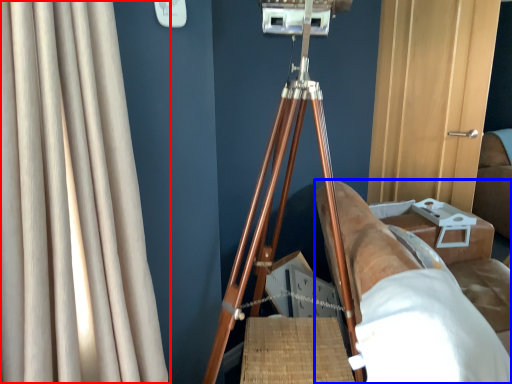
Question: Which point is further to the camera, curtain (highlighted by a red box) or furniture (highlighted by a blue box)?

Choices:
 (A) curtain
 (B) furniture

Answer: (B)